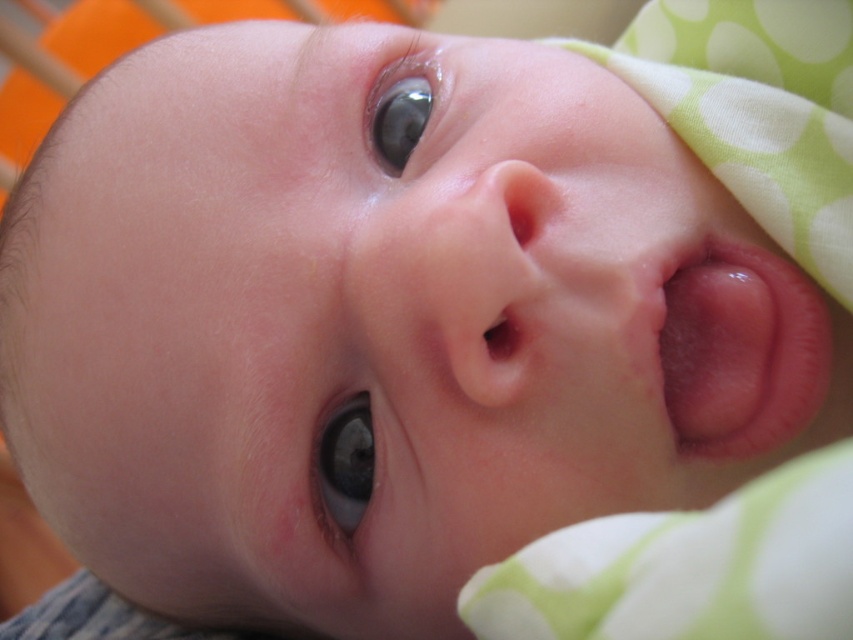
You are a photographer adjusting the focus on your camera. You have two points in the image to focus on, point 1 at point 1 at point (524, 259) and point 2 at point (346, 468). Which point should you focus on to capture the baby with the most detail?

Point 1 at point (524, 259) is closer to the camera than point 2 at point (346, 468), so focusing on point 1 at point (524, 259) will capture the baby with the most detail.

You are a pediatrician examining a baby. You notice the pink smooth tongue at center and the glossy blue eye at upper center. Which of these is closer to you?

The pink smooth tongue at center is closer to you because it is in front of the glossy blue eye at upper center.